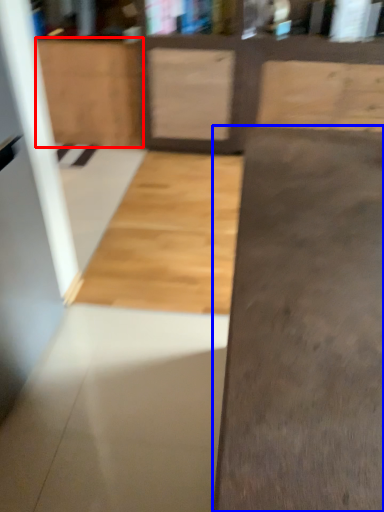
Question: Which point is further to the camera, cabinetry (highlighted by a red box) or concrete (highlighted by a blue box)?

Choices:
 (A) cabinetry
 (B) concrete

Answer: (A)